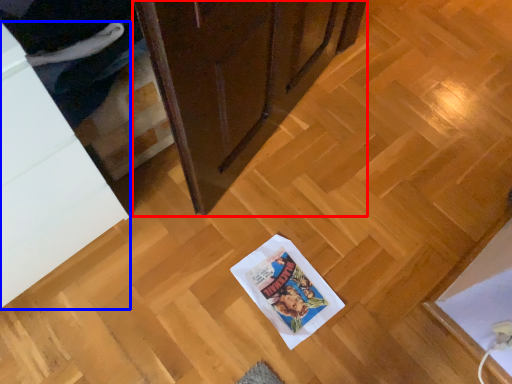
Question: Among these objects, which one is nearest to the camera, cabinetry (highlighted by a red box) or cabinetry (highlighted by a blue box)?

Choices:
 (A) cabinetry
 (B) cabinetry

Answer: (B)